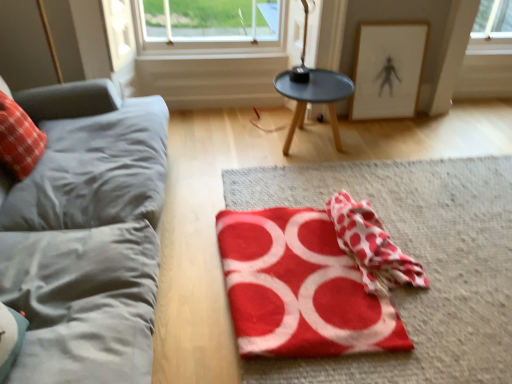
The width and height of the screenshot is (512, 384). I want to click on blank space to the left of black matte table at center, so click(240, 144).